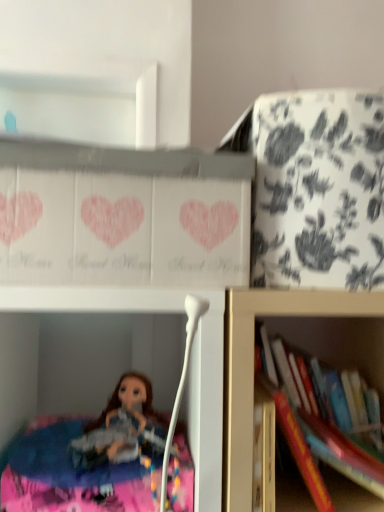
Question: From the image's perspective, relative to white floral-patterned cabinet at upper right, positioned as the first cabinet in right-to-left order, is hardcover book at right, arranged as the second book when viewed from the front, above or below?

Choices:
 (A) below
 (B) above

Answer: (A)

Question: Is hardcover book at right, arranged as the second book when viewed from the front, taller or shorter than white floral-patterned cabinet at upper right, positioned as the first cabinet in right-to-left order?

Choices:
 (A) tall
 (B) short

Answer: (B)

Question: Estimate the real-world distances between objects in this image. Which object is farther from the white cardboard box at upper center, which is the 2th cabinet from right to left?

Choices:
 (A) hardcover book at right, placed as the first book when sorted from back to front
 (B) hardcover book at lower right, positioned as the 2th book in back-to-front order
 (C) white floral-patterned cabinet at upper right, positioned as the 2th cabinet in left-to-right order

Answer: (B)

Question: Considering the real-world distances, which object is farthest from the hardcover book at right, arranged as the second book when viewed from the front?

Choices:
 (A) white floral-patterned cabinet at upper right, positioned as the first cabinet in right-to-left order
 (B) white cardboard box at upper center, which is the 2th cabinet from right to left
 (C) hardcover book at lower right, positioned as the 2th book in back-to-front order

Answer: (B)